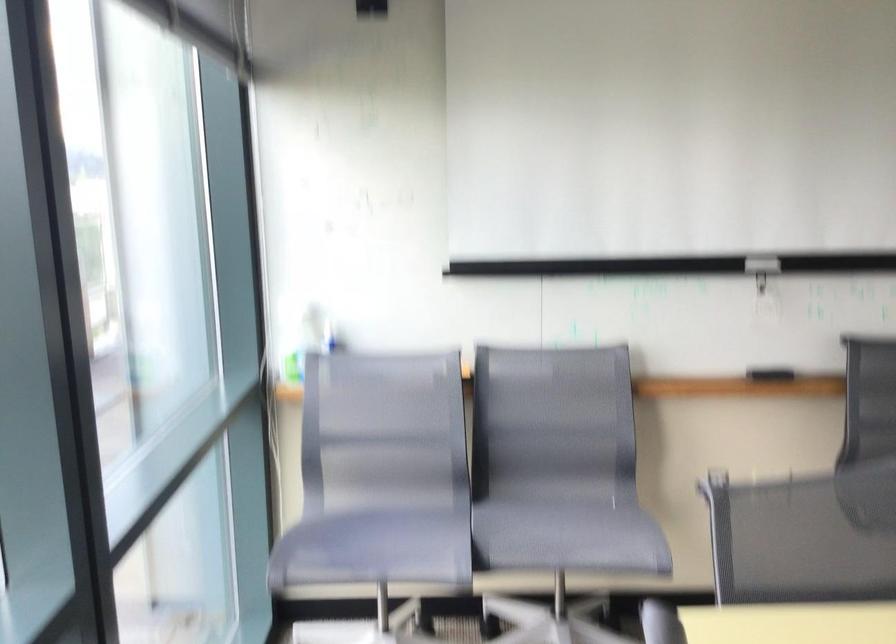
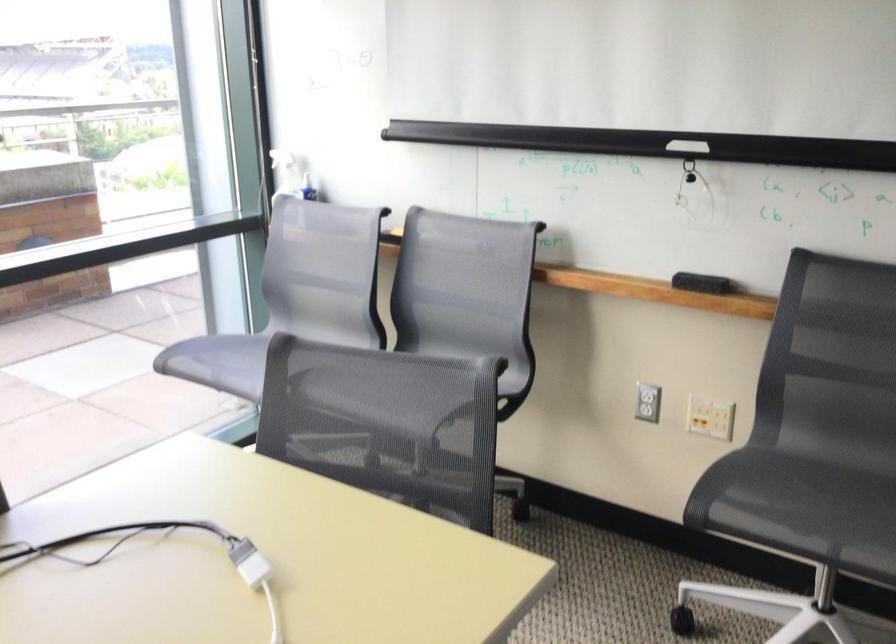
Locate, in the second image, the point that corresponds to point (509, 471) in the first image.

(426, 337)